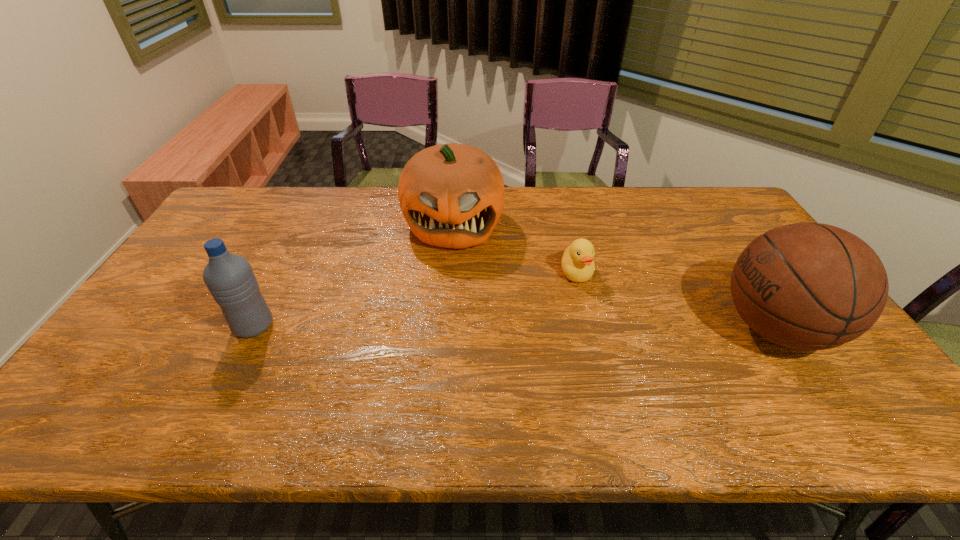
In the image, there is a desktop. At what (x,y) coordinates should I click in order to perform the action: click on free space at the far edge. Please return your answer as a coordinate pair (x, y). The height and width of the screenshot is (540, 960). Looking at the image, I should click on (333, 191).

Locate an element on the screen. vacant region at the near edge of the desktop is located at coordinates (285, 384).

Locate an element on the screen. The width and height of the screenshot is (960, 540). vacant space at the left edge of the desktop is located at coordinates (206, 300).

What are the coordinates of `vacant area at the near right corner of the desktop` in the screenshot? It's located at (809, 375).

This screenshot has height=540, width=960. Identify the location of unoccupied area between the second object from left to right and the basketball. (614, 276).

Image resolution: width=960 pixels, height=540 pixels. I want to click on unoccupied area between the pumpkin and the third object from left to right, so [x=515, y=248].

Locate an element on the screen. vacant area between the leftmost object and the third object from left to right is located at coordinates (415, 299).

Where is `empty location between the rightmost object and the farthest object`? The width and height of the screenshot is (960, 540). empty location between the rightmost object and the farthest object is located at coordinates (614, 276).

Identify the location of free spot between the basketball and the pumpkin. The image size is (960, 540). (614, 276).

The width and height of the screenshot is (960, 540). What are the coordinates of `vacant area that lies between the leftmost object and the shortest object` in the screenshot? It's located at (415, 299).